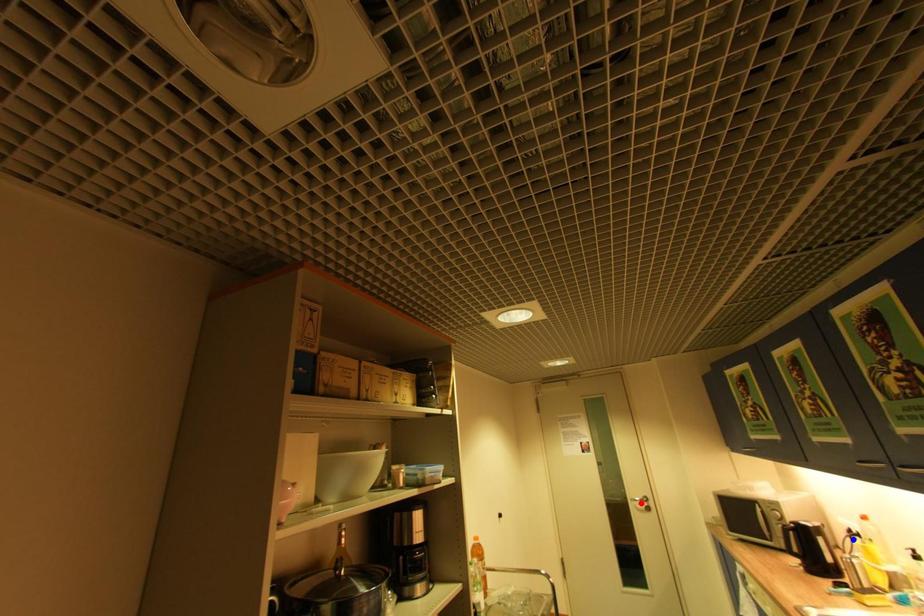
Question: In the image, two points are highlighted. Which point is nearer to the camera? Reply with the corresponding letter.

Choices:
 (A) blue point
 (B) red point

Answer: (A)